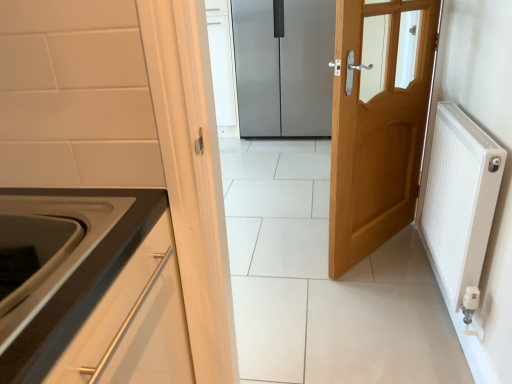
Question: Which direction should I rotate to look at light wood door at center, acting as the first door starting from the front?

Choices:
 (A) left
 (B) right

Answer: (B)

Question: Can you confirm if satin silver refrigerator at center, which appears as the 2th door when viewed from the front, is wider than white glossy oven at lower left?

Choices:
 (A) yes
 (B) no

Answer: (A)

Question: Does satin silver refrigerator at center, the first door from the back, have a larger size compared to white glossy oven at lower left?

Choices:
 (A) yes
 (B) no

Answer: (A)

Question: Is satin silver refrigerator at center, which appears as the 2th door when viewed from the front, directly adjacent to white glossy oven at lower left?

Choices:
 (A) no
 (B) yes

Answer: (A)

Question: From the image's perspective, would you say satin silver refrigerator at center, the first door from the back, is shown under white glossy oven at lower left?

Choices:
 (A) yes
 (B) no

Answer: (B)

Question: Can you confirm if satin silver refrigerator at center, which appears as the 2th door when viewed from the front, is positioned to the right of white glossy oven at lower left?

Choices:
 (A) yes
 (B) no

Answer: (A)

Question: Is the depth of satin silver refrigerator at center, which appears as the 2th door when viewed from the front, less than that of white glossy oven at lower left?

Choices:
 (A) no
 (B) yes

Answer: (A)

Question: Does white glossy oven at lower left appear on the right side of light wood door at center, acting as the first door starting from the front?

Choices:
 (A) yes
 (B) no

Answer: (B)

Question: Is white glossy oven at lower left at the left side of light wood door at center, acting as the first door starting from the front?

Choices:
 (A) yes
 (B) no

Answer: (A)

Question: Is white glossy oven at lower left facing towards light wood door at center, acting as the first door starting from the front?

Choices:
 (A) no
 (B) yes

Answer: (A)

Question: From a real-world perspective, is white glossy oven at lower left physically above light wood door at center, the second door when ordered from back to front?

Choices:
 (A) no
 (B) yes

Answer: (B)

Question: Is white glossy oven at lower left surrounding light wood door at center, acting as the first door starting from the front?

Choices:
 (A) no
 (B) yes

Answer: (A)

Question: Considering the relative positions of white glossy oven at lower left and light wood door at center, acting as the first door starting from the front, in the image provided, is white glossy oven at lower left in front of light wood door at center, acting as the first door starting from the front,?

Choices:
 (A) yes
 (B) no

Answer: (A)

Question: Is white ribbed radiator at right smaller than light wood door at center, acting as the first door starting from the front?

Choices:
 (A) no
 (B) yes

Answer: (B)